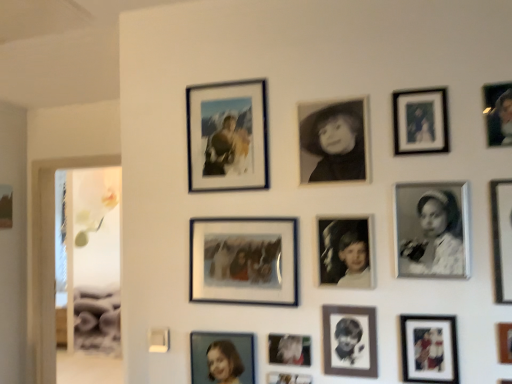
Question: Is matte glass photo frame at upper center, which is counted as the 2th picture frame, starting from the back, closer to camera compared to matte glass photo frame at center, placed as the eleventh picture frame when sorted from right to left?

Choices:
 (A) yes
 (B) no

Answer: (B)

Question: Would you say matte glass photo frame at upper center, marked as the 3th picture frame in a left-to-right arrangement, is outside matte glass photo frame at center, placed as the 4th picture frame when sorted from left to right?

Choices:
 (A) yes
 (B) no

Answer: (A)

Question: From the image's perspective, is matte glass photo frame at upper center, the thirteenth picture frame positioned from the front, on top of matte glass photo frame at center, placed as the eleventh picture frame when sorted from right to left?

Choices:
 (A) yes
 (B) no

Answer: (A)

Question: Does matte glass photo frame at upper center, marked as the 3th picture frame in a left-to-right arrangement, have a larger size compared to matte glass photo frame at center, which is the fourth picture frame from back to front?

Choices:
 (A) yes
 (B) no

Answer: (A)

Question: Is matte glass photo frame at upper center, the thirteenth picture frame positioned from the front, thinner than matte glass photo frame at center, placed as the eleventh picture frame when sorted from right to left?

Choices:
 (A) no
 (B) yes

Answer: (A)

Question: Is matte glass photo frame at upper center, the 12th picture frame from the right, positioned with its back to matte glass photo frame at center, the eleventh picture frame in the front-to-back sequence?

Choices:
 (A) no
 (B) yes

Answer: (A)

Question: Is black paper portrait at center, which is the 9th picture frame from back to front, oriented towards black matte photo frame at center-right, the 4th picture frame from the front?

Choices:
 (A) yes
 (B) no

Answer: (B)

Question: Does black paper portrait at center, the 6th picture frame in the right-to-left sequence, have a greater width compared to black matte photo frame at center-right, the 4th picture frame from the front?

Choices:
 (A) yes
 (B) no

Answer: (B)

Question: From a real-world perspective, does black paper portrait at center, which is counted as the sixth picture frame, starting from the front, stand above black matte photo frame at center-right, the 4th picture frame from the front?

Choices:
 (A) no
 (B) yes

Answer: (A)

Question: Can you confirm if black paper portrait at center, the 6th picture frame in the right-to-left sequence, is shorter than black matte photo frame at center-right, the 12th picture frame when ordered from left to right?

Choices:
 (A) yes
 (B) no

Answer: (A)

Question: Is black paper portrait at center, the 6th picture frame in the right-to-left sequence, next to black matte photo frame at center-right, which is the eleventh picture frame in back-to-front order, and touching it?

Choices:
 (A) no
 (B) yes

Answer: (A)

Question: Does black paper portrait at center, which is counted as the 9th picture frame, starting from the left, lie behind black matte photo frame at center-right, which ranks as the 3th picture frame in right-to-left order?

Choices:
 (A) no
 (B) yes

Answer: (B)

Question: Is black matte photo at center, the 7th picture frame from the right, in front of black paper portrait at center, which is the 9th picture frame from back to front?

Choices:
 (A) no
 (B) yes

Answer: (A)